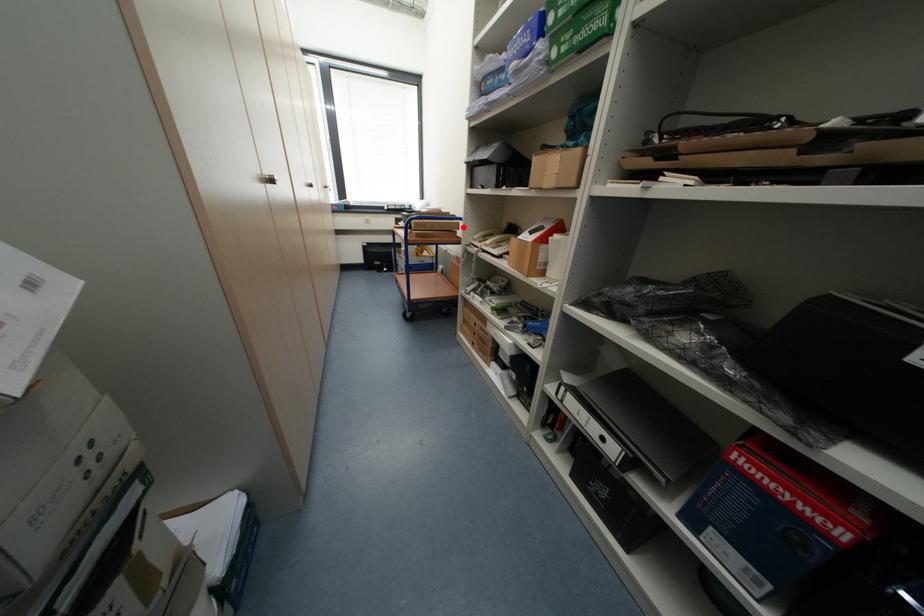
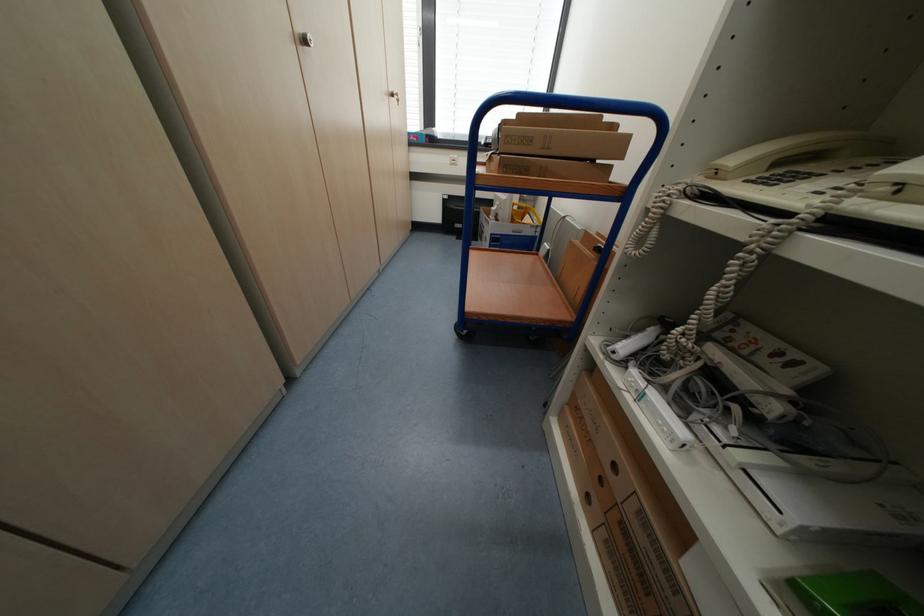
Where in the second image is the point corresponding to the highlighted location from the first image?

(627, 148)